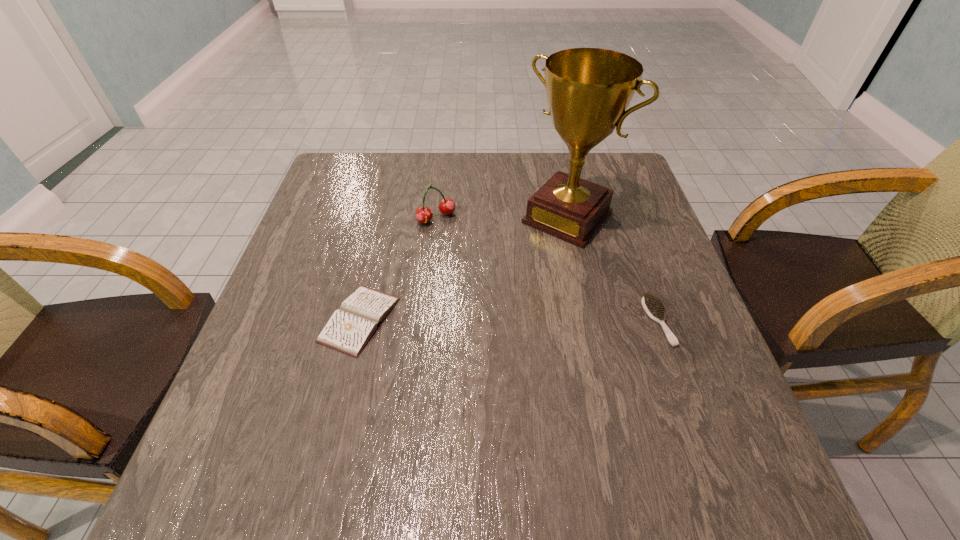
In the image, there is a desktop. In order to click on vacant space at the left edge in this screenshot , I will do `click(282, 356)`.

The width and height of the screenshot is (960, 540). Find the location of `vacant space at the right edge of the desktop`. vacant space at the right edge of the desktop is located at coordinates click(x=622, y=276).

In the image, there is a desktop. Where is `blank space at the near left corner`? blank space at the near left corner is located at coordinates point(276,440).

What are the coordinates of `free space at the far right corner of the desktop` in the screenshot? It's located at (608, 160).

Locate an element on the screen. The image size is (960, 540). vacant space at the near right corner of the desktop is located at coordinates (724, 405).

Identify the location of free space that is in between the third tallest object and the third object from right to left. The width and height of the screenshot is (960, 540). (547, 270).

Identify the location of vacant space that's between the third shortest object and the award. The width and height of the screenshot is (960, 540). (502, 218).

Find the location of a particular element. Image resolution: width=960 pixels, height=540 pixels. free space between the diary and the tallest object is located at coordinates (464, 268).

You are a GUI agent. You are given a task and a screenshot of the screen. Output one action in this format:
    pyautogui.click(x=<x>, y=<y>)
    Task: Click on the free space between the scrubbing brush and the tallest object
    
    Given the screenshot: What is the action you would take?
    pyautogui.click(x=612, y=269)

Locate an element on the screen. This screenshot has width=960, height=540. vacant space that's between the cherry and the tallest object is located at coordinates tap(502, 218).